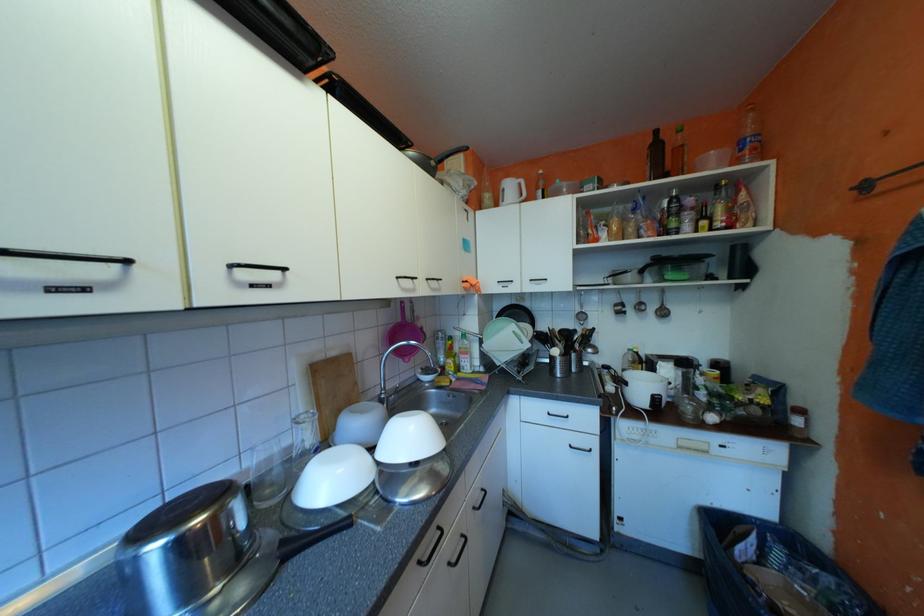
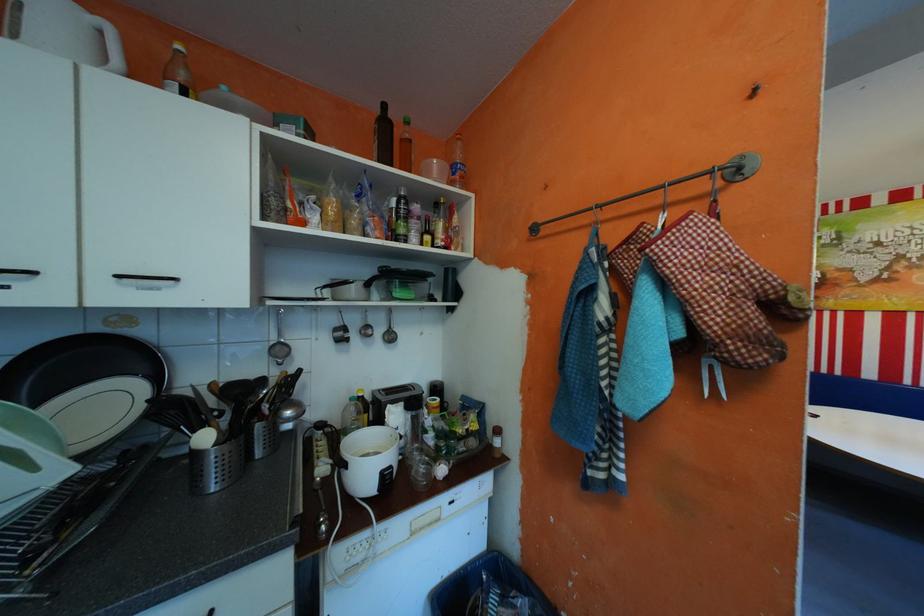
Find the pixel in the second image that matches [648,352] in the first image.

(372, 397)